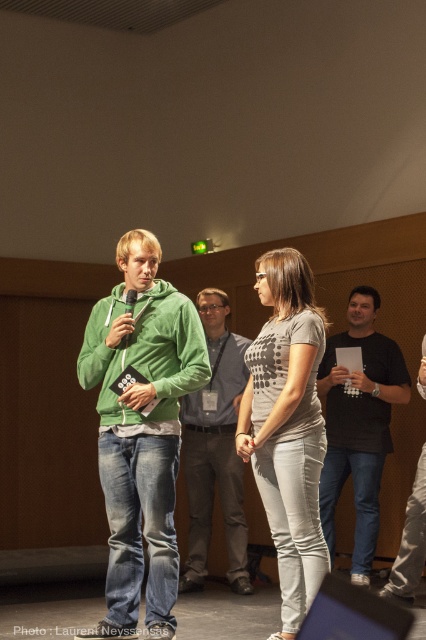
Question: Which of the following is the farthest from the observer?

Choices:
 (A) gray dotted t-shirt at center
 (B) black matte shirt at right
 (C) green fabric shirt at center
 (D) green fleece hoodie at center

Answer: (C)

Question: Observing the image, what is the correct spatial positioning of green fleece hoodie at center in reference to black matte shirt at center?

Choices:
 (A) above
 (B) below

Answer: (A)

Question: Can you confirm if black matte shirt at center is positioned to the left of green fabric shirt at center?

Choices:
 (A) yes
 (B) no

Answer: (B)

Question: Among these points, which one is farthest from the camera?

Choices:
 (A) (192, 486)
 (B) (367, 388)
 (C) (423, 556)

Answer: (A)

Question: In this image, where is gray dotted t-shirt at center located relative to black matte shirt at right?

Choices:
 (A) below
 (B) above

Answer: (B)

Question: Which object is the closest to the gray dotted t-shirt at center?

Choices:
 (A) black matte shirt at right
 (B) green fleece hoodie at center
 (C) black matte shirt at center
 (D) green fabric shirt at center

Answer: (B)